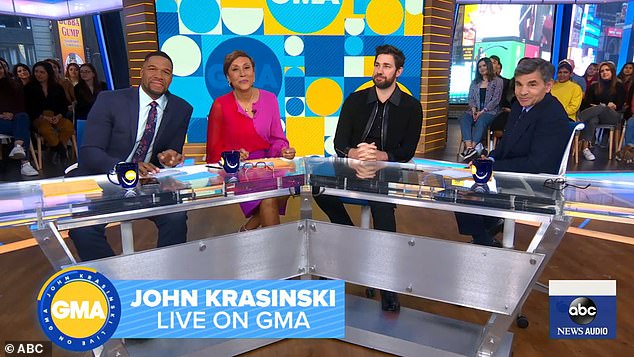
Identify the location of glass desktop. coord(408,172).